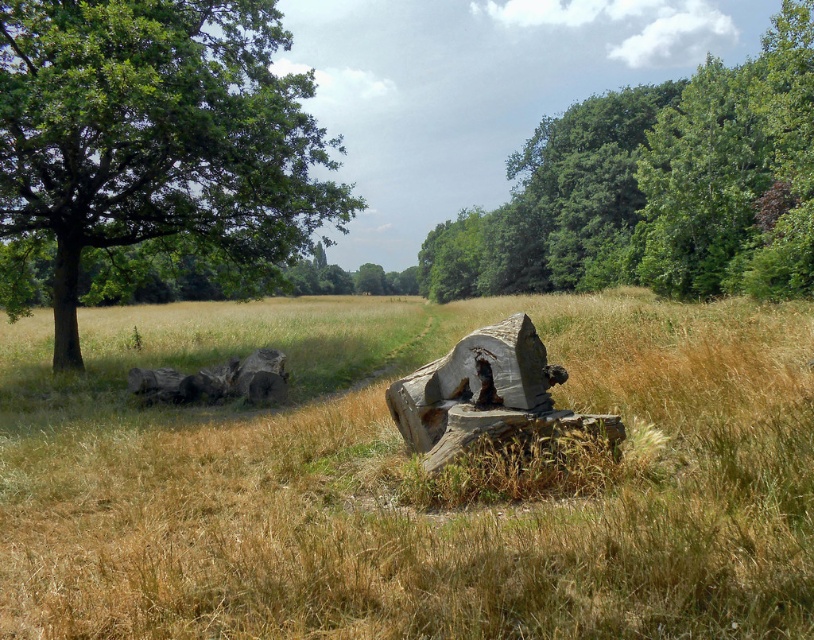
You are a bird seeking shelter. You see a green rough bark tree at left and a weathered wood stump at center. Which one offers higher elevation for a better vantage point?

→ The green rough bark tree at left is much taller than the weathered wood stump at center, so it offers a higher elevation for a better vantage point.